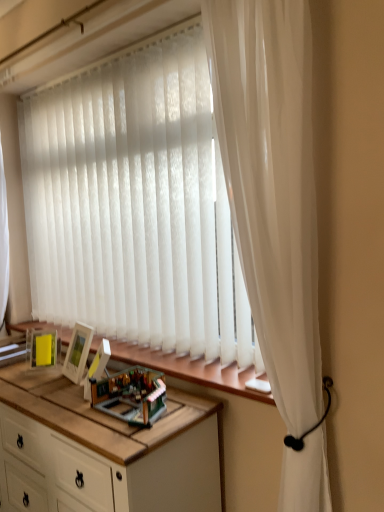
Question: Does white sheer curtain at right have a lesser width compared to translucent plastic toy at center?

Choices:
 (A) yes
 (B) no

Answer: (B)

Question: Would you say white sheer curtain at right is outside translucent plastic toy at center?

Choices:
 (A) yes
 (B) no

Answer: (A)

Question: Considering the relative positions of white sheer curtain at right and translucent plastic toy at center in the image provided, is white sheer curtain at right to the right of translucent plastic toy at center from the viewer's perspective?

Choices:
 (A) no
 (B) yes

Answer: (B)

Question: From the image's perspective, is white sheer curtain at right above translucent plastic toy at center?

Choices:
 (A) yes
 (B) no

Answer: (A)

Question: Does white sheer curtain at right have a larger size compared to translucent plastic toy at center?

Choices:
 (A) no
 (B) yes

Answer: (B)

Question: From a real-world perspective, is wooden at lower center positioned above or below white sheer curtain at right?

Choices:
 (A) below
 (B) above

Answer: (A)

Question: Visually, is wooden at lower center positioned to the left or to the right of white sheer curtain at right?

Choices:
 (A) left
 (B) right

Answer: (A)

Question: Considering the positions of wooden at lower center and white sheer curtain at right in the image, is wooden at lower center taller or shorter than white sheer curtain at right?

Choices:
 (A) short
 (B) tall

Answer: (A)

Question: Is wooden at lower center in front of or behind white sheer curtain at right in the image?

Choices:
 (A) front
 (B) behind

Answer: (B)

Question: Is wooden at lower center wider or thinner than white wood cabinet at center?

Choices:
 (A) thin
 (B) wide

Answer: (A)

Question: In terms of size, does wooden at lower center appear bigger or smaller than white wood cabinet at center?

Choices:
 (A) small
 (B) big

Answer: (A)

Question: From the image's perspective, is wooden at lower center located above or below white wood cabinet at center?

Choices:
 (A) above
 (B) below

Answer: (A)

Question: Based on their positions, is wooden at lower center located to the left or right of white wood cabinet at center?

Choices:
 (A) right
 (B) left

Answer: (A)

Question: Relative to translucent plastic toy at center, is white wood cabinet at center in front or behind?

Choices:
 (A) front
 (B) behind

Answer: (A)

Question: Is white wood cabinet at center bigger or smaller than translucent plastic toy at center?

Choices:
 (A) small
 (B) big

Answer: (B)